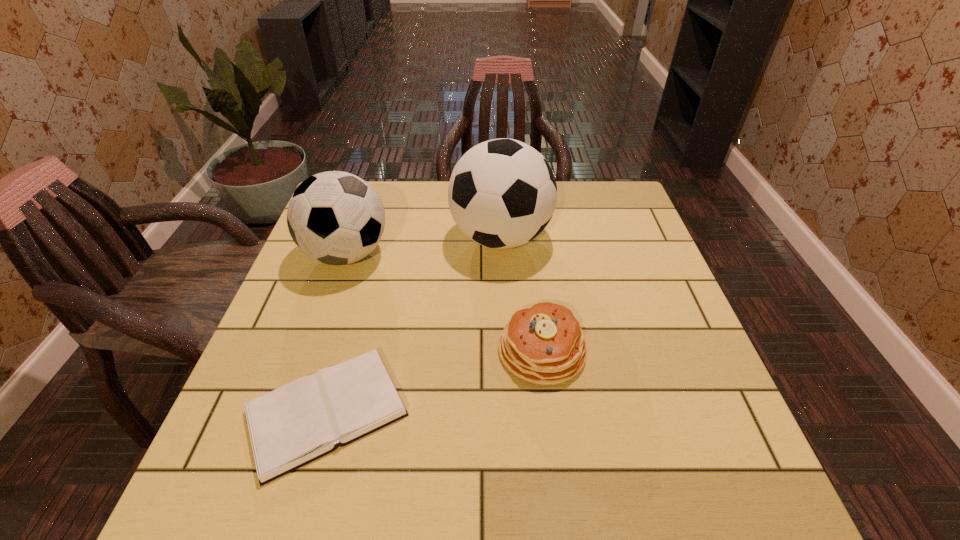
Find the location of a particular element. Image resolution: width=960 pixels, height=540 pixels. object positioned at the far edge is located at coordinates (502, 193).

Find the location of `object that is at the near edge`. object that is at the near edge is located at coordinates (303, 420).

The width and height of the screenshot is (960, 540). What are the coordinates of `soccer ball located at the left edge` in the screenshot? It's located at (335, 217).

Locate an element on the screen. hardback book that is at the left edge is located at coordinates point(303,420).

Find the location of a particular element. object that is at the near left corner is located at coordinates (303, 420).

In the image, there is a desktop. Identify the location of blank space at the far edge. (428, 211).

The width and height of the screenshot is (960, 540). Find the location of `free space at the near edge of the desktop`. free space at the near edge of the desktop is located at coordinates (463, 507).

Locate an element on the screen. Image resolution: width=960 pixels, height=540 pixels. vacant space at the right edge of the desktop is located at coordinates (618, 244).

The width and height of the screenshot is (960, 540). What are the coordinates of `blank space at the near left corner of the desktop` in the screenshot? It's located at (278, 479).

In the image, there is a desktop. Where is `free space at the far right corner`? This screenshot has height=540, width=960. free space at the far right corner is located at coordinates tap(604, 192).